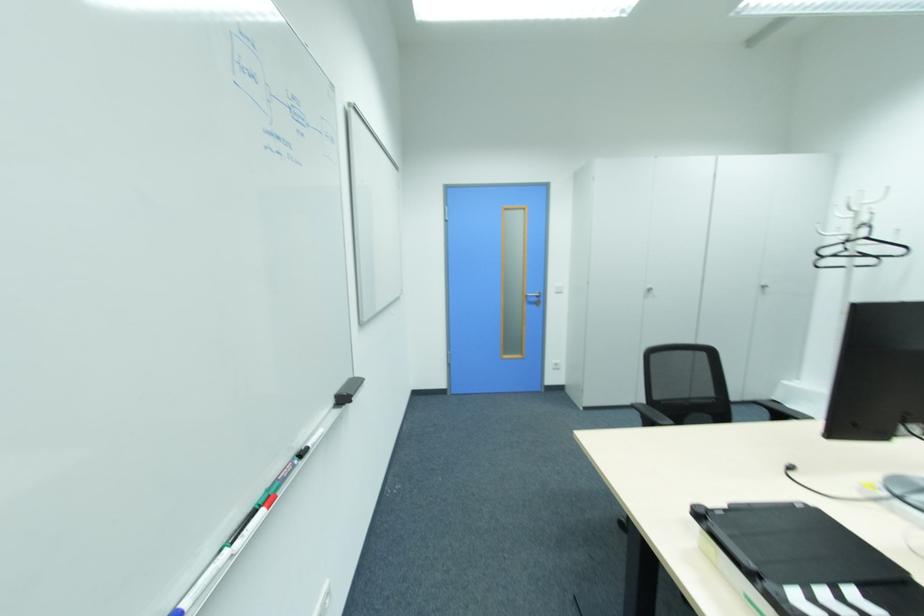
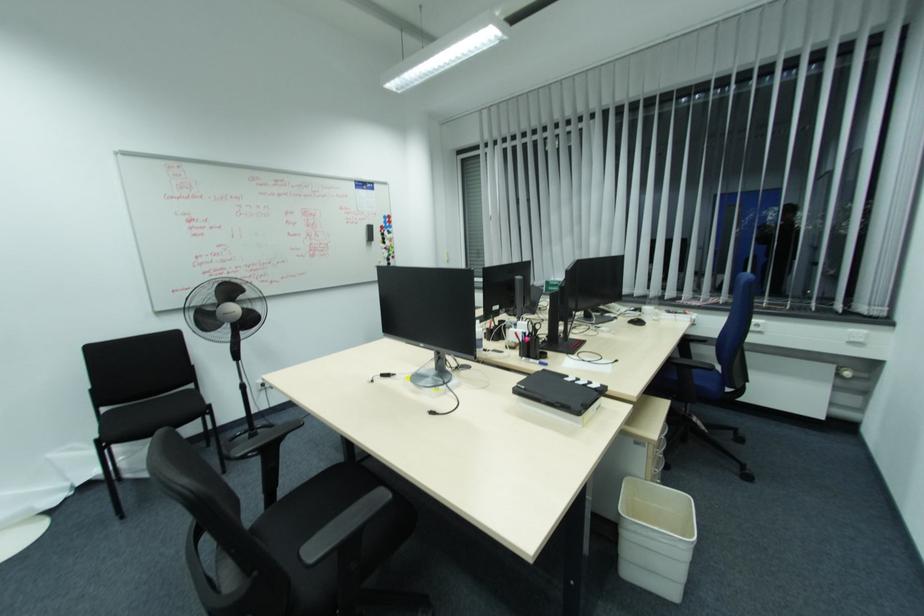
Where in the second image is the point corresponding to (725,506) from the first image?

(560, 403)